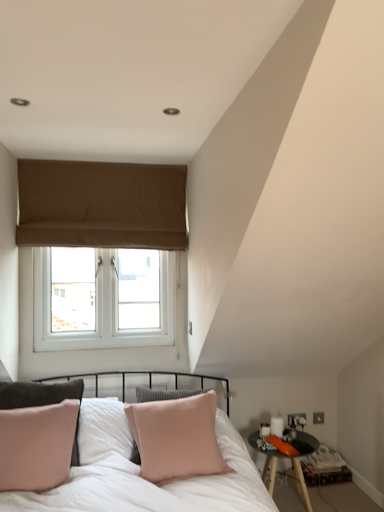
Question: From a real-world perspective, does black wooden table at lower right stand above brown fabric window at upper center?

Choices:
 (A) yes
 (B) no

Answer: (B)

Question: Are black wooden table at lower right and brown fabric window at upper center far apart?

Choices:
 (A) yes
 (B) no

Answer: (A)

Question: Can you confirm if black wooden table at lower right is thinner than brown fabric window at upper center?

Choices:
 (A) yes
 (B) no

Answer: (B)

Question: Is the depth of black wooden table at lower right greater than that of brown fabric window at upper center?

Choices:
 (A) yes
 (B) no

Answer: (B)

Question: Is black wooden table at lower right wider than brown fabric window at upper center?

Choices:
 (A) no
 (B) yes

Answer: (B)

Question: Does black wooden table at lower right have a larger size compared to brown fabric window at upper center?

Choices:
 (A) no
 (B) yes

Answer: (A)

Question: Does pink velvet pillow at center have a lesser width compared to brown fabric window at upper center?

Choices:
 (A) yes
 (B) no

Answer: (B)

Question: Can you confirm if pink velvet pillow at center is bigger than brown fabric window at upper center?

Choices:
 (A) no
 (B) yes

Answer: (B)

Question: Does pink velvet pillow at center have a greater width compared to brown fabric window at upper center?

Choices:
 (A) yes
 (B) no

Answer: (A)

Question: Does pink velvet pillow at center lie in front of brown fabric window at upper center?

Choices:
 (A) no
 (B) yes

Answer: (B)

Question: Is pink velvet pillow at center not within brown fabric window at upper center?

Choices:
 (A) no
 (B) yes

Answer: (B)

Question: Would you say brown fabric window at upper center is part of pink velvet pillow at center's contents?

Choices:
 (A) no
 (B) yes

Answer: (A)

Question: Is black wooden table at lower right behind pink velvet pillow at center?

Choices:
 (A) no
 (B) yes

Answer: (B)